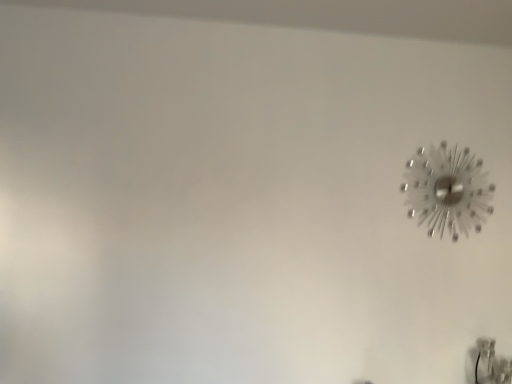
What do you see at coordinates (447, 191) in the screenshot? I see `metallic silver wall clock at upper right` at bounding box center [447, 191].

In order to face metallic silver wall clock at upper right, should I rotate leftwards or rightwards?

Turn right by 23.930 degrees to look at metallic silver wall clock at upper right.

Measure the distance between metallic silver wall clock at upper right and camera.

metallic silver wall clock at upper right is 6.80 feet away from camera.

I want to click on metallic silver wall clock at upper right, so click(x=447, y=191).

This screenshot has width=512, height=384. Identify the location of metallic silver wall clock at upper right. pyautogui.click(x=447, y=191).